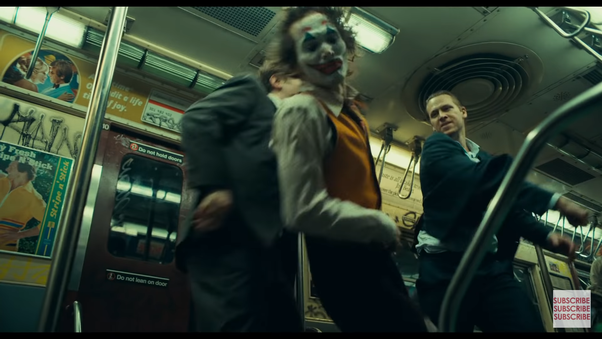
Identify the location of vent. (504, 63).